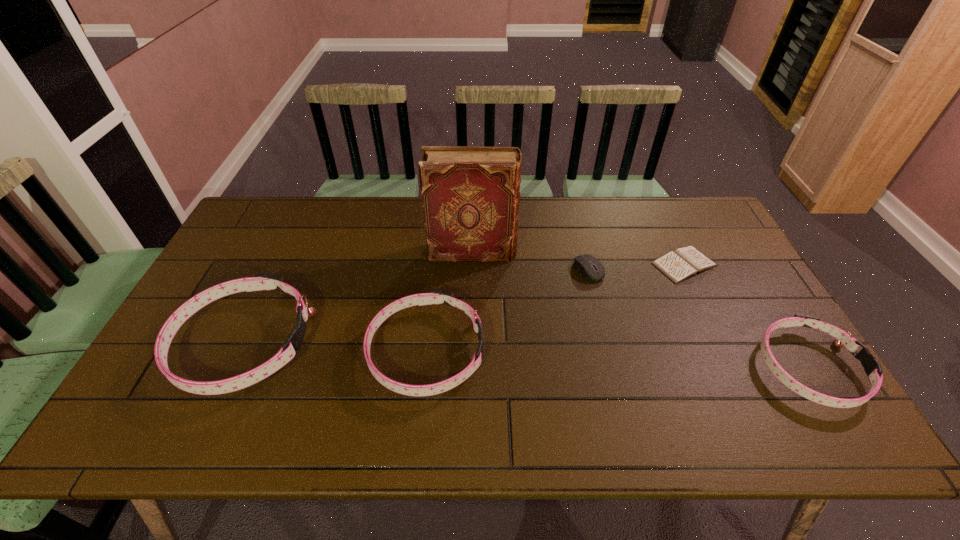
You are a GUI agent. You are given a task and a screenshot of the screen. Output one action in this format:
    pyautogui.click(x=<x>, y=<y>)
    Task: Click on the leftmost object
    
    Given the screenshot: What is the action you would take?
    pyautogui.click(x=264, y=281)

The width and height of the screenshot is (960, 540). Find the location of `the second tallest dog collar`. the second tallest dog collar is located at coordinates (435, 296).

The height and width of the screenshot is (540, 960). Identify the location of the second dog collar from right to left. (435, 296).

The height and width of the screenshot is (540, 960). I want to click on the rightmost dog collar, so click(872, 367).

The height and width of the screenshot is (540, 960). I want to click on the third shortest object, so click(872, 367).

You are a GUI agent. You are given a task and a screenshot of the screen. Output one action in this format:
    pyautogui.click(x=<x>, y=<y>)
    Task: Click on the tallest object
    The image size is (960, 540).
    Given the screenshot: What is the action you would take?
    pyautogui.click(x=470, y=195)

Identify the location of diary. This screenshot has height=540, width=960. (683, 263).

I want to click on the fourth object from left to right, so click(x=584, y=263).

Find the location of a particular element. The image size is (960, 540). computer equipment is located at coordinates (584, 263).

This screenshot has height=540, width=960. Find the location of `vacant space located 0.350m with the buckle on the leftmost object`. vacant space located 0.350m with the buckle on the leftmost object is located at coordinates (444, 344).